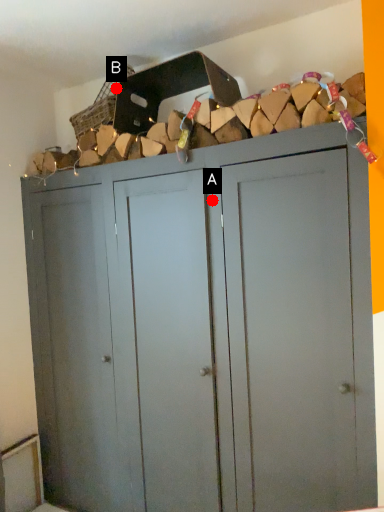
Question: Two points are circled on the image, labeled by A and B beside each circle. Which point appears farthest from the camera in this image?

Choices:
 (A) A is further
 (B) B is further

Answer: (B)